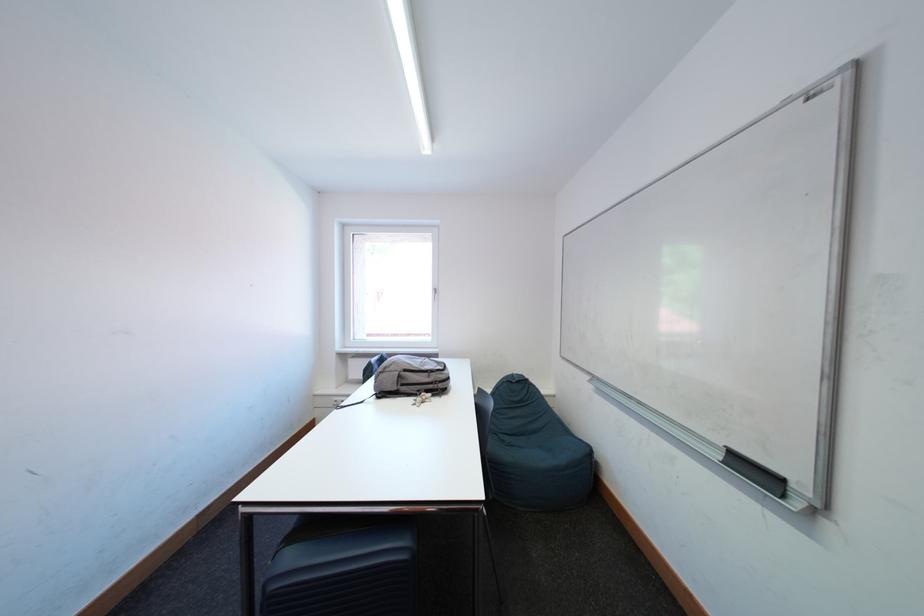
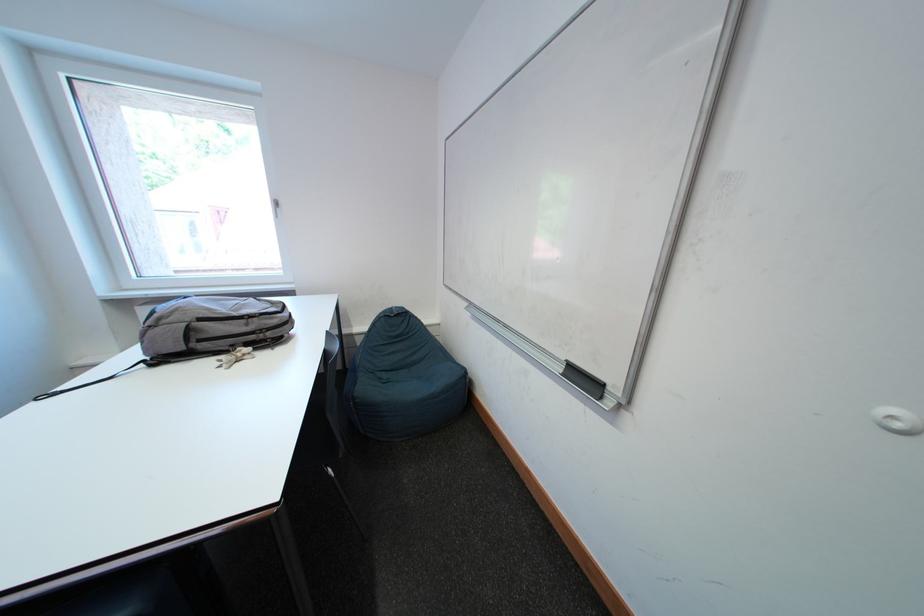
Find the pixel in the second image that matches [761,475] in the first image.

(591, 383)